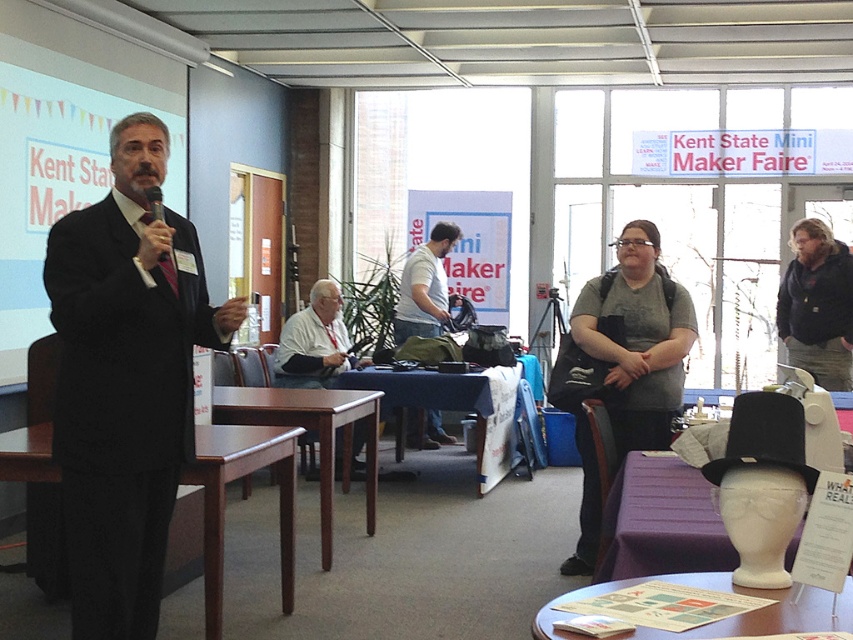
Is the position of gray fabric purse at center more distant than that of white glossy table at lower center?

That is True.

Where is `gray fabric purse at center`? The height and width of the screenshot is (640, 853). gray fabric purse at center is located at coordinates (637, 339).

Is the position of brown wooden table at left more distant than that of white glossy table at lower center?

Yes, brown wooden table at left is behind white glossy table at lower center.

From the picture: Who is higher up, brown wooden table at left or white glossy table at lower center?

Positioned higher is white glossy table at lower center.

Identify the location of brown wooden table at left. (224, 500).

Does point (583, 288) come farther from viewer compared to point (300, 419)?

No, (583, 288) is in front of (300, 419).

Which is above, gray fabric purse at center or mahogany wood table at center?

gray fabric purse at center

You are a GUI agent. You are given a task and a screenshot of the screen. Output one action in this format:
    pyautogui.click(x=<x>, y=<y>)
    Task: Click on the gray fabric purse at center
    The height and width of the screenshot is (640, 853).
    Given the screenshot: What is the action you would take?
    pyautogui.click(x=637, y=339)